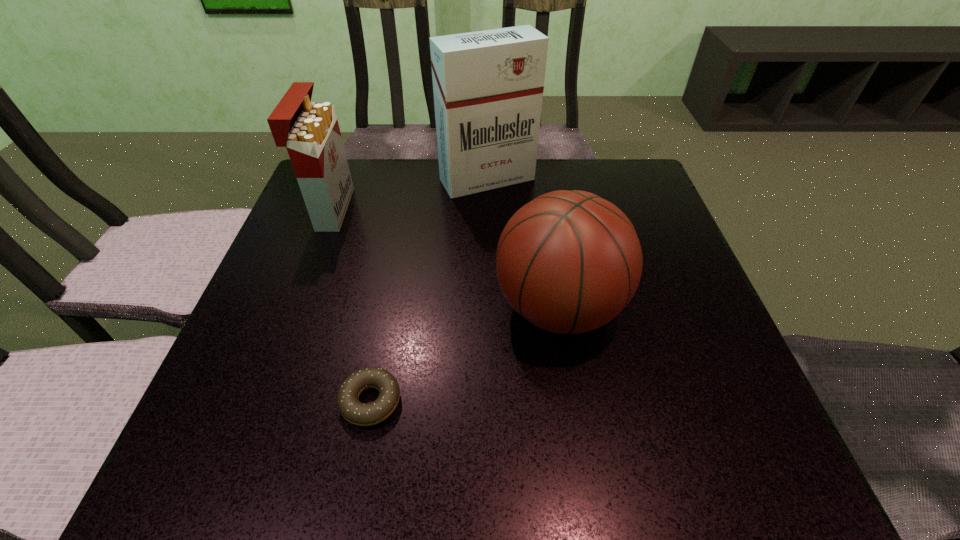
You are a GUI agent. You are given a task and a screenshot of the screen. Output one action in this format:
    pyautogui.click(x=<x>, y=<y>)
    Task: Click on the free spot that satisfies the following two spatial constraints: 1. on the back side of the nearest object; 2. with the lid open on the left cigarette case
    
    Given the screenshot: What is the action you would take?
    pyautogui.click(x=407, y=209)

This screenshot has height=540, width=960. I want to click on free space in the image that satisfies the following two spatial constraints: 1. with the lid open on the shorter cigarette case; 2. on the back side of the doughnut, so click(x=258, y=401).

This screenshot has width=960, height=540. Find the location of `vacant position in the image that satisfies the following two spatial constraints: 1. with the lid open on the left cigarette case; 2. on the right side of the basketball`. vacant position in the image that satisfies the following two spatial constraints: 1. with the lid open on the left cigarette case; 2. on the right side of the basketball is located at coordinates (294, 308).

The height and width of the screenshot is (540, 960). I want to click on blank area in the image that satisfies the following two spatial constraints: 1. with the lid open on the basketball; 2. on the right side of the left cigarette case, so click(294, 308).

Where is `free space that satisfies the following two spatial constraints: 1. with the lid open on the left cigarette case; 2. on the left side of the second nearest object`? The height and width of the screenshot is (540, 960). free space that satisfies the following two spatial constraints: 1. with the lid open on the left cigarette case; 2. on the left side of the second nearest object is located at coordinates (294, 308).